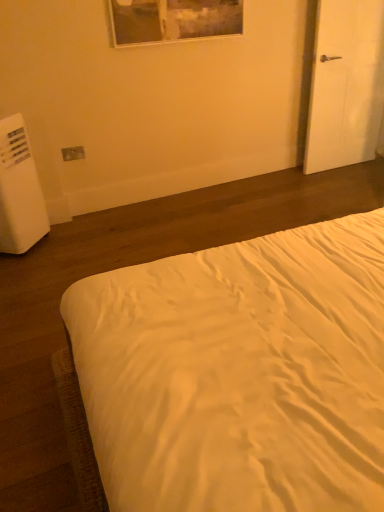
The image size is (384, 512). I want to click on matte plastic outlet at lower left, so click(x=73, y=153).

Between point (212, 422) and point (81, 158), which one is positioned behind?

The point (81, 158) is farther.

In the scene shown: How many degrees apart are the facing directions of white satin bed at center and matte plastic outlet at lower left?

The angular difference between white satin bed at center and matte plastic outlet at lower left is 86.6 degrees.

From a real-world perspective, which object stands above the other?

From a 3D spatial view, matte plastic outlet at lower left is above.

Considering the relative positions of white plastic water heater at left and white matte door at right in the image provided, is white plastic water heater at left behind white matte door at right?

No, it is in front of white matte door at right.

Could you tell me if white plastic water heater at left is turned towards white matte door at right?

No, white plastic water heater at left is not oriented towards white matte door at right.

Is white plastic water heater at left touching white matte door at right?

No.

Looking at this image, from a real-world perspective, between white plastic water heater at left and white matte door at right, who is vertically lower?

white plastic water heater at left, from a real-world perspective.

How far apart are white matte door at right and matte plastic outlet at lower left?

The distance of white matte door at right from matte plastic outlet at lower left is 6.91 feet.

From a real-world perspective, is white matte door at right on top of matte plastic outlet at lower left?

Indeed, from a real-world perspective, white matte door at right stands above matte plastic outlet at lower left.

Is matte plastic outlet at lower left inside white matte door at right?

No, white matte door at right does not contain matte plastic outlet at lower left.

Could you tell me if white plastic water heater at left is facing matte plastic outlet at lower left?

No, white plastic water heater at left is not oriented towards matte plastic outlet at lower left.

Is the depth of white plastic water heater at left less than that of matte plastic outlet at lower left?

Yes.

From a real-world perspective, which object stands above the other?

matte plastic outlet at lower left.

Can you confirm if white matte door at right is smaller than white satin bed at center?

Yes.

Visually, is white matte door at right positioned to the left or to the right of white satin bed at center?

white matte door at right is to the right of white satin bed at center.

Is white matte door at right positioned beyond the bounds of white satin bed at center?

Yes, white matte door at right is not within white satin bed at center.

Is white matte door at right wider or thinner than white satin bed at center?

white matte door at right is thinner than white satin bed at center.

Can you confirm if matte plastic outlet at lower left is shorter than white matte door at right?

Yes.

Does matte plastic outlet at lower left have a larger size compared to white matte door at right?

No, matte plastic outlet at lower left is not bigger than white matte door at right.

Is matte plastic outlet at lower left not close to white matte door at right?

matte plastic outlet at lower left is positioned a significant distance from white matte door at right.

From the image's perspective, relative to white matte door at right, is matte plastic outlet at lower left above or below?

matte plastic outlet at lower left is situated lower than white matte door at right in the image.

Considering the points (376, 69) and (6, 182), which point is behind, point (376, 69) or point (6, 182)?

The point (376, 69) is behind.

The height and width of the screenshot is (512, 384). Identify the location of door above the white plastic water heater at left (from a real-world perspective). (346, 84).

How different are the orientations of white matte door at right and white plastic water heater at left in degrees?

The angle between the facing direction of white matte door at right and the facing direction of white plastic water heater at left is 0.637 degrees.

From the image's perspective, is white matte door at right over white plastic water heater at left?

Indeed, from the image's perspective, white matte door at right is shown above white plastic water heater at left.

The image size is (384, 512). I want to click on electric outlet positioned vertically above the white satin bed at center (from a real-world perspective), so click(x=73, y=153).

Image resolution: width=384 pixels, height=512 pixels. I want to click on door that appears behind the white plastic water heater at left, so click(346, 84).

Estimate the real-world distances between objects in this image. Which object is closer to white plastic water heater at left, white matte door at right or white satin bed at center?

white satin bed at center is closer to white plastic water heater at left.

When comparing their distances from matte plastic outlet at lower left, does white matte door at right or white satin bed at center seem closer?

white matte door at right is positioned closer to the anchor matte plastic outlet at lower left.

When comparing their distances from white satin bed at center, does white matte door at right or matte plastic outlet at lower left seem closer?

Based on the image, matte plastic outlet at lower left appears to be nearer to white satin bed at center.

Which object lies nearer to the anchor point matte plastic outlet at lower left, white plastic water heater at left or white satin bed at center?

Among the two, white plastic water heater at left is located nearer to matte plastic outlet at lower left.

From the picture: Which object lies nearer to the anchor point white plastic water heater at left, matte plastic outlet at lower left or white satin bed at center?

matte plastic outlet at lower left is closer to white plastic water heater at left.

Considering their positions, is white satin bed at center positioned closer to white plastic water heater at left than matte plastic outlet at lower left?

Among the two, matte plastic outlet at lower left is located nearer to white plastic water heater at left.

Estimate the real-world distances between objects in this image. Which object is closer to white satin bed at center, matte plastic outlet at lower left or white matte door at right?

matte plastic outlet at lower left is closer to white satin bed at center.

Considering their positions, is white matte door at right positioned closer to white plastic water heater at left than matte plastic outlet at lower left?

matte plastic outlet at lower left lies closer to white plastic water heater at left than the other object.

Locate an element on the screen. bed situated between matte plastic outlet at lower left and white matte door at right from left to right is located at coordinates (239, 373).

Find the location of a particular element. bed located between white plastic water heater at left and white matte door at right in the left-right direction is located at coordinates (239, 373).

You are a GUI agent. You are given a task and a screenshot of the screen. Output one action in this format:
    pyautogui.click(x=<x>, y=<y>)
    Task: Click on the water heater between white satin bed at center and matte plastic outlet at lower left from front to back
    The width and height of the screenshot is (384, 512).
    Given the screenshot: What is the action you would take?
    pyautogui.click(x=19, y=191)

You are a GUI agent. You are given a task and a screenshot of the screen. Output one action in this format:
    pyautogui.click(x=<x>, y=<y>)
    Task: Click on the electric outlet situated between white plastic water heater at left and white matte door at right from left to right
    Image resolution: width=384 pixels, height=512 pixels.
    Given the screenshot: What is the action you would take?
    pyautogui.click(x=73, y=153)